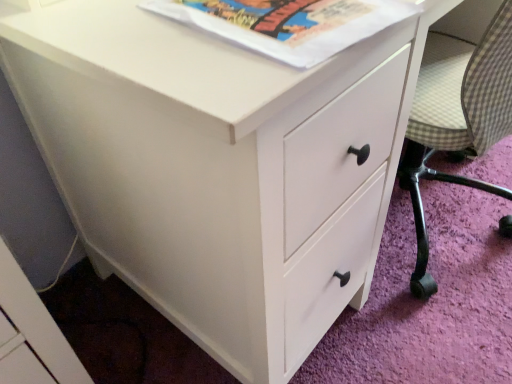
You are a GUI agent. You are given a task and a screenshot of the screen. Output one action in this format:
    pyautogui.click(x=<x>, y=<y>)
    Task: Click on the vacant area in front of checkered fabric armchair at right
    
    Given the screenshot: What is the action you would take?
    pyautogui.click(x=425, y=330)